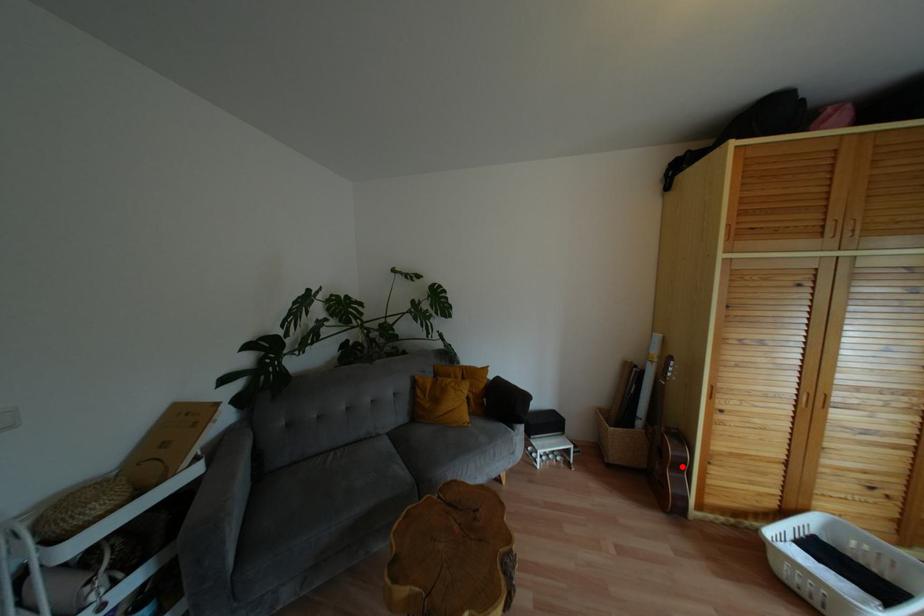
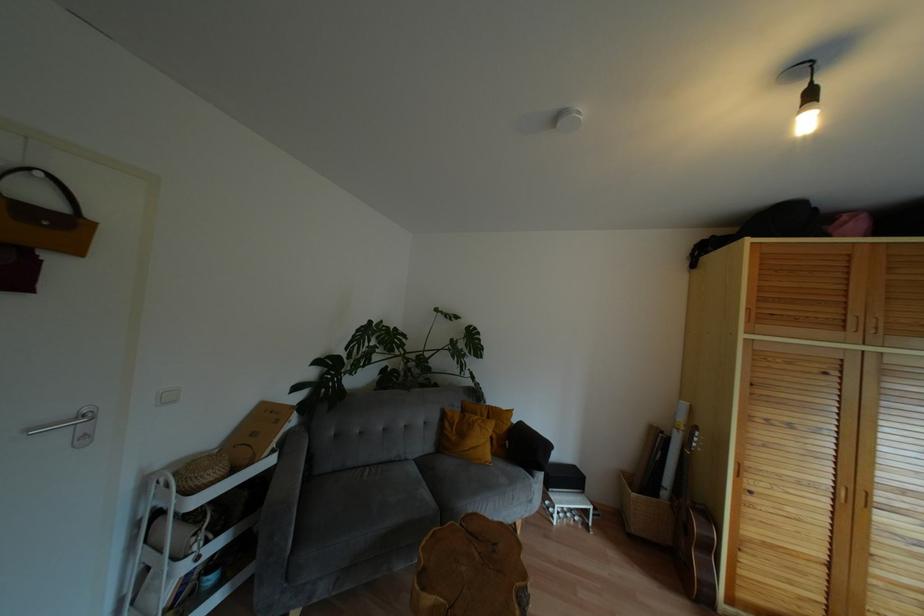
Question: I am providing you with two images of the same scene from different viewpoints. A red point is marked on the first image. At the location where the point appears in image 1, is it still visible in image 2?

Choices:
 (A) Yes
 (B) No

Answer: (A)